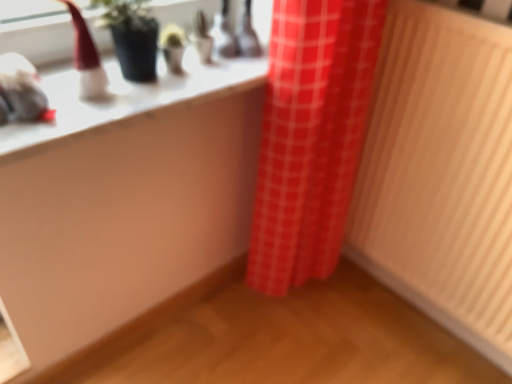
Locate an element on the screen. vacant space in front of wooden radiator at right is located at coordinates (409, 356).